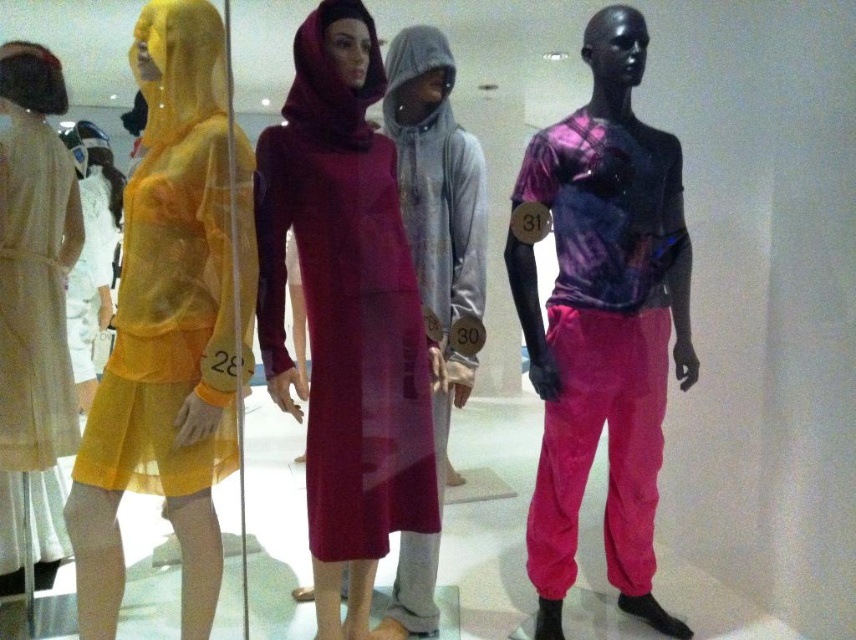
Question: Based on their relative distances, which object is nearer to the gray fleece hoodie at center?

Choices:
 (A) light beige pleated dress at left
 (B) velvet burgundy dress at center
 (C) matte yellow dress at left

Answer: (B)

Question: Which point is farther to the camera?

Choices:
 (A) light beige pleated dress at left
 (B) velvet burgundy dress at center

Answer: (A)

Question: Among these points, which one is nearest to the camera?

Choices:
 (A) (452, 372)
 (B) (90, 269)

Answer: (A)

Question: Is velvet burgundy dress at center positioned before light beige pleated dress at left?

Choices:
 (A) yes
 (B) no

Answer: (A)

Question: Does shiny purple fabric shirt at center have a greater width compared to matte yellow dress at left?

Choices:
 (A) no
 (B) yes

Answer: (B)

Question: Is velvet burgundy dress at center to the right of shiny purple fabric shirt at center from the viewer's perspective?

Choices:
 (A) yes
 (B) no

Answer: (B)